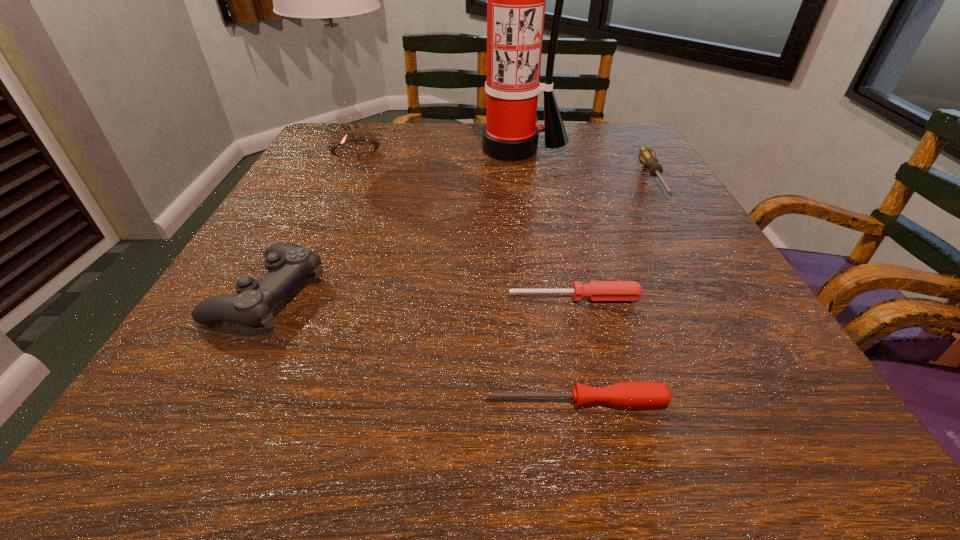
Where is `fire extinguisher`? The height and width of the screenshot is (540, 960). fire extinguisher is located at coordinates (516, 0).

You are a GUI agent. You are given a task and a screenshot of the screen. Output one action in this format:
    pyautogui.click(x=<x>, y=<y>)
    Task: Click on the table lamp
    The height and width of the screenshot is (540, 960).
    Given the screenshot: What is the action you would take?
    pyautogui.click(x=328, y=0)

Identify the location of control. (287, 263).

You are a GUI agent. You are given a task and a screenshot of the screen. Output one action in this format:
    pyautogui.click(x=<x>, y=<y>)
    Task: Click on the tallest screwdriver
    
    Given the screenshot: What is the action you would take?
    pyautogui.click(x=647, y=157)

You are a GUI agent. You are given a task and a screenshot of the screen. Output one action in this format:
    pyautogui.click(x=<x>, y=<y>)
    Task: Click on the rightmost screwdriver
    The image size is (960, 540).
    Given the screenshot: What is the action you would take?
    pyautogui.click(x=647, y=157)

The width and height of the screenshot is (960, 540). Identify the location of the second nearest screwdriver. (595, 290).

I want to click on the nearest screwdriver, so point(624,395).

Identify the location of vacant space located at the nozzle of the tallest object. (522, 213).

At what (x,y) coordinates should I click in order to perform the action: click on free location located on the front-facing side of the fifth shortest object. Please return your answer as a coordinate pair (x, y). Looking at the image, I should click on (437, 149).

What are the coordinates of `vacant space located on the right of the control` in the screenshot? It's located at (388, 294).